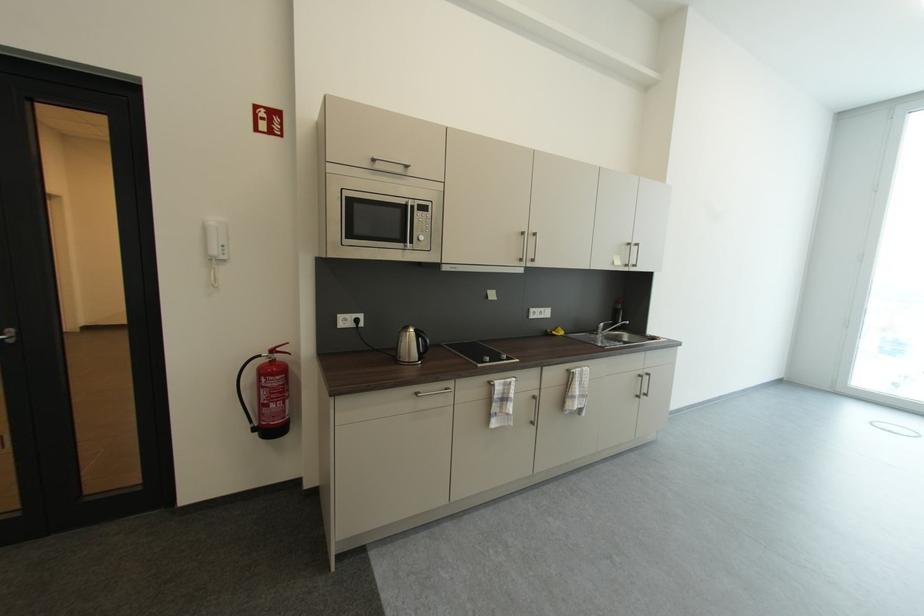
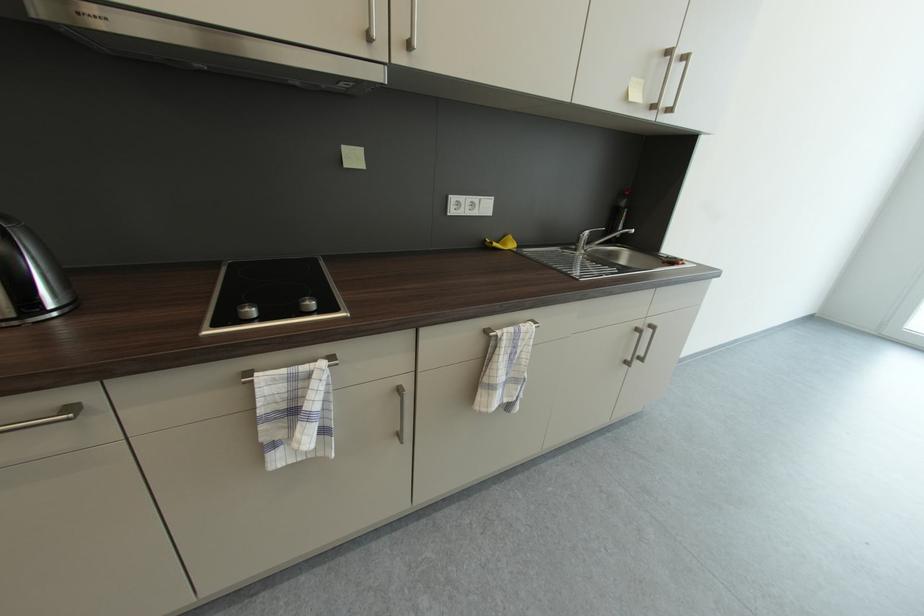
In a continuous first-person perspective shot, in which direction is the camera moving?

The cameraman moved toward right, forward.